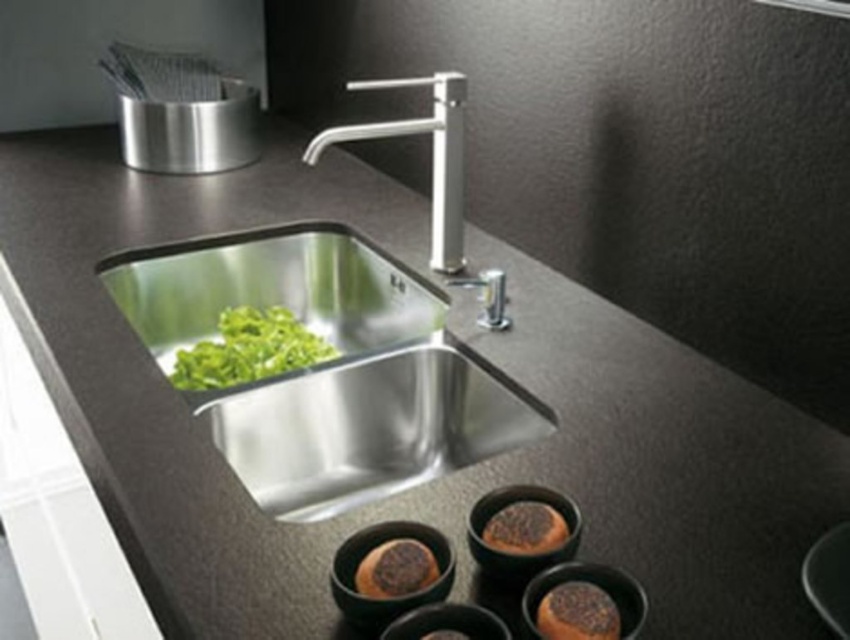
You are a chef preparing to place a brown matte bread at lower center on the counter. The polished stainless steel faucet at upper center is in the way. Can you move the bread to the right side of the faucet without moving the faucet itself?

The distance between the polished stainless steel faucet at upper center and the brown matte bread at lower center is 28.95 inches. Since the bread needs to be moved to the right side of the faucet, there is sufficient space available on the counter to reposition it without moving the faucet itself.

You are a baker who needs to choose between the brown matte bread at lower center and the brown crumbly bread at lower center for a recipe that requires a larger piece of bread. Which bread should you select?

The brown matte bread at lower center has a larger size compared to the brown crumbly bread at lower center, so you should select the brown matte bread at lower center for the recipe.

In the scene shown: You are a chef preparing ingredients and need to place the brown crumbly bread at lower center onto the polished stainless steel faucet at upper center. Can you do this without moving the faucet?

The brown crumbly bread at lower center is behind the polished stainless steel faucet at upper center, so you cannot place it onto the faucet without moving it first.